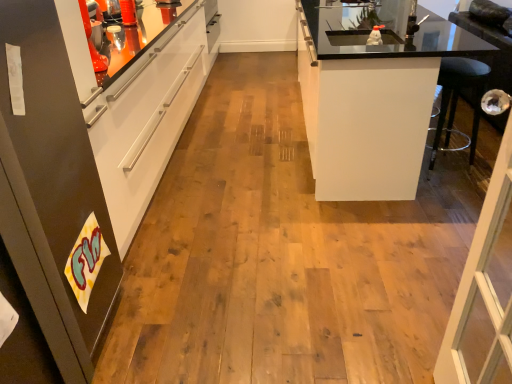
Question: Looking at the image, does matte black refrigerator at left, which appears as the 2th cabinetry when viewed from the back, seem bigger or smaller compared to white glossy cabinet at right, placed as the first cabinetry when sorted from back to front?

Choices:
 (A) small
 (B) big

Answer: (A)

Question: Is matte black refrigerator at left, which appears as the 2th cabinetry when viewed from the back, to the left or to the right of white glossy cabinet at right, the second cabinetry from the front, in the image?

Choices:
 (A) right
 (B) left

Answer: (B)

Question: From the image's perspective, relative to white glossy cabinet at right, which is the 1th cabinetry from right to left, is matte black refrigerator at left, arranged as the first cabinetry when viewed from the front, above or below?

Choices:
 (A) above
 (B) below

Answer: (B)

Question: In terms of size, does white glossy cabinet at right, the second cabinetry from the front, appear bigger or smaller than matte black refrigerator at left, which appears as the 2th cabinetry when viewed from the back?

Choices:
 (A) big
 (B) small

Answer: (A)

Question: From the image's perspective, is white glossy cabinet at right, which is the second cabinetry in left-to-right order, above or below matte black refrigerator at left, which appears as the 2th cabinetry when viewed from the back?

Choices:
 (A) below
 (B) above

Answer: (B)

Question: Would you say white glossy cabinet at right, which is the second cabinetry in left-to-right order, is to the left or to the right of matte black refrigerator at left, which is the first cabinetry from left to right, in the picture?

Choices:
 (A) left
 (B) right

Answer: (B)

Question: Relative to matte black refrigerator at left, which appears as the 2th cabinetry when viewed from the back, is white glossy cabinet at right, the second cabinetry from the front, in front or behind?

Choices:
 (A) behind
 (B) front

Answer: (A)